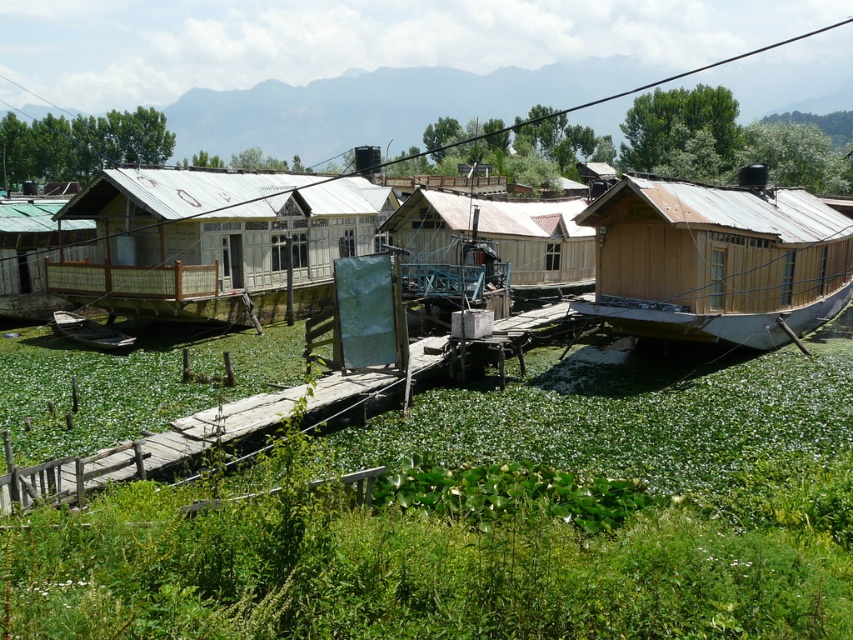
At what (x,y) coordinates should I click in order to perform the action: click on wooden hut at center. Please return your answer as a coordinate pair (x, y). This screenshot has height=640, width=853. Looking at the image, I should click on (498, 236).

Is wooden hut at center shorter than green bamboo hut at left?

Yes, wooden hut at center is shorter than green bamboo hut at left.

The image size is (853, 640). In order to click on wooden hut at center in this screenshot , I will do `click(498, 236)`.

The width and height of the screenshot is (853, 640). I want to click on wooden hut at center, so click(498, 236).

Is white wooden house at center to the left of wooden hut at center from the viewer's perspective?

Indeed, white wooden house at center is positioned on the left side of wooden hut at center.

Is white wooden house at center shorter than wooden hut at center?

Incorrect, white wooden house at center's height does not fall short of wooden hut at center's.

Between point (103, 262) and point (549, 218), which one is positioned in front?

Point (103, 262) is more forward.

Where is `white wooden house at center`? The width and height of the screenshot is (853, 640). white wooden house at center is located at coordinates (216, 241).

The height and width of the screenshot is (640, 853). What do you see at coordinates (36, 252) in the screenshot?
I see `green bamboo hut at left` at bounding box center [36, 252].

Does green bamboo hut at left lie behind wooden boat at lower left?

Yes, green bamboo hut at left is further from the viewer.

I want to click on green bamboo hut at left, so click(36, 252).

The height and width of the screenshot is (640, 853). I want to click on green bamboo hut at left, so click(x=36, y=252).